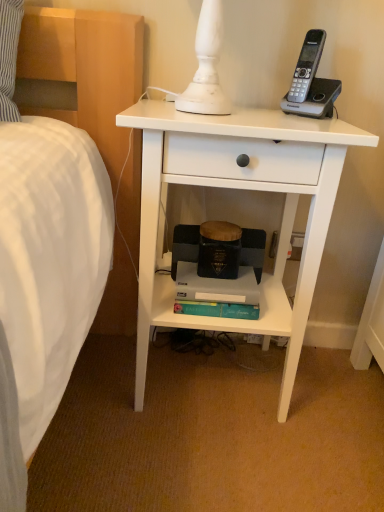
You are a GUI agent. You are given a task and a screenshot of the screen. Output one action in this format:
    pyautogui.click(x=<x>, y=<y>)
    Task: Click on the vacant area in front of white matte nightstand at center
    This screenshot has width=384, height=512.
    Given the screenshot: What is the action you would take?
    pyautogui.click(x=200, y=464)